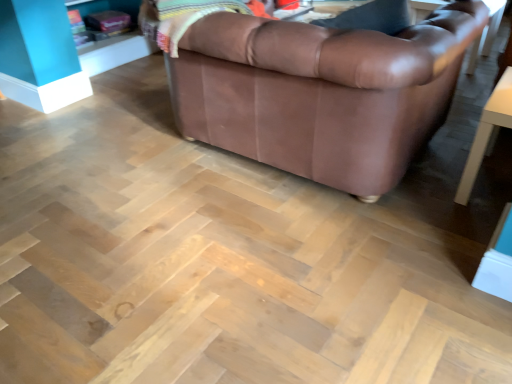
Consider the image. What is the approximate height of brown leather couch at upper center?

The height of brown leather couch at upper center is 29.39 inches.

The image size is (512, 384). I want to click on brown leather couch at upper center, so click(321, 92).

What do you see at coordinates (321, 92) in the screenshot? I see `brown leather couch at upper center` at bounding box center [321, 92].

What is the approximate height of white glossy table at lower right?

white glossy table at lower right is 18.34 inches in height.

What is the approximate width of white glossy table at lower right?

white glossy table at lower right is 55.78 centimeters wide.

Where is `white glossy table at lower right`? The image size is (512, 384). white glossy table at lower right is located at coordinates (487, 133).

What do you see at coordinates (487, 133) in the screenshot?
I see `white glossy table at lower right` at bounding box center [487, 133].

Find the location of a particular element. The width and height of the screenshot is (512, 384). brown leather couch at upper center is located at coordinates (321, 92).

Is brown leather couch at upper center at the left side of white glossy table at lower right?

Yes, brown leather couch at upper center is to the left of white glossy table at lower right.

Does brown leather couch at upper center come in front of white glossy table at lower right?

That is True.

Is point (327, 115) positioned after point (511, 120)?

That is True.

From the image's perspective, which is above, brown leather couch at upper center or white glossy table at lower right?

brown leather couch at upper center is shown above in the image.

From a real-world perspective, relative to white glossy table at lower right, is brown leather couch at upper center vertically above or below?

In terms of real-world spatial position, brown leather couch at upper center is above white glossy table at lower right.

Which of these two, brown leather couch at upper center or white glossy table at lower right, is wider?

brown leather couch at upper center is wider.

From their relative heights in the image, would you say brown leather couch at upper center is taller or shorter than white glossy table at lower right?

Considering their sizes, brown leather couch at upper center has more height than white glossy table at lower right.

In terms of size, does brown leather couch at upper center appear bigger or smaller than white glossy table at lower right?

In the image, brown leather couch at upper center appears to be larger than white glossy table at lower right.

In the scene shown: Is white glossy table at lower right completely or partially inside brown leather couch at upper center?

No, white glossy table at lower right is not a part of brown leather couch at upper center.

Can you see brown leather couch at upper center touching white glossy table at lower right?

They are not placed beside each other.

Is brown leather couch at upper center turned away from white glossy table at lower right?

No, brown leather couch at upper center is not facing away from white glossy table at lower right.

How many degrees apart are the facing directions of brown leather couch at upper center and white glossy table at lower right?

There is a 179-degree angle between the facing directions of brown leather couch at upper center and white glossy table at lower right.

This screenshot has width=512, height=384. What are the coordinates of `studio couch in front of the white glossy table at lower right` in the screenshot? It's located at coord(321,92).

Visually, is white glossy table at lower right positioned to the left or to the right of brown leather couch at upper center?

From the image, it's evident that white glossy table at lower right is to the right of brown leather couch at upper center.

Based on the photo, is white glossy table at lower right in front of or behind brown leather couch at upper center in the image?

white glossy table at lower right is positioned farther from the viewer than brown leather couch at upper center.

Which is closer to the camera, (x=480, y=131) or (x=259, y=78)?

Positioned in front is point (x=259, y=78).

From the image's perspective, is white glossy table at lower right on brown leather couch at upper center?

No, from the image's perspective, white glossy table at lower right is not above brown leather couch at upper center.

From a real-world perspective, between white glossy table at lower right and brown leather couch at upper center, who is vertically higher?

brown leather couch at upper center is physically above.

Between white glossy table at lower right and brown leather couch at upper center, which one has larger width?

brown leather couch at upper center is wider.

From their relative heights in the image, would you say white glossy table at lower right is taller or shorter than brown leather couch at upper center?

Considering their sizes, white glossy table at lower right has less height than brown leather couch at upper center.

Consider the image. Between white glossy table at lower right and brown leather couch at upper center, which one has smaller size?

white glossy table at lower right is smaller.

Is white glossy table at lower right outside of brown leather couch at upper center?

white glossy table at lower right is positioned outside brown leather couch at upper center.

Would you consider white glossy table at lower right to be distant from brown leather couch at upper center?

white glossy table at lower right is near brown leather couch at upper center, not far away.

Is white glossy table at lower right facing towards brown leather couch at upper center?

No, white glossy table at lower right does not turn towards brown leather couch at upper center.

In the image, there is a white glossy table at lower right. At what (x,y) coordinates should I click in order to perform the action: click on studio couch above it (from the image's perspective). Please return your answer as a coordinate pair (x, y). The width and height of the screenshot is (512, 384). Looking at the image, I should click on (321, 92).

Where is `table below the brown leather couch at upper center (from a real-world perspective)`? The image size is (512, 384). table below the brown leather couch at upper center (from a real-world perspective) is located at coordinates (487, 133).

Where is `studio couch in front of the white glossy table at lower right`? studio couch in front of the white glossy table at lower right is located at coordinates (321, 92).